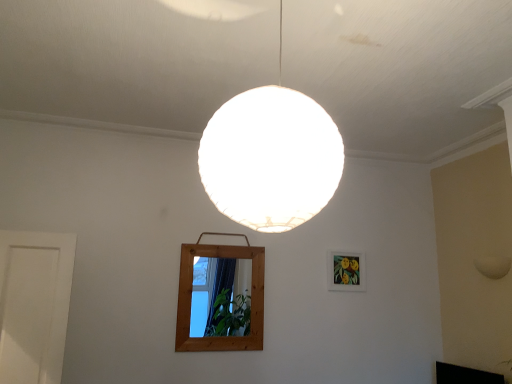
In order to face black glossy tv at lower right, should I rotate leftwards or rightwards?

A 26.263 degree turn to the right will do.

At what (x,y) coordinates should I click in order to perform the action: click on black glossy tv at lower right. Please return your answer as a coordinate pair (x, y). Image resolution: width=512 pixels, height=384 pixels. Looking at the image, I should click on pyautogui.click(x=465, y=375).

Is matte wooden picture frame at upper right closer to the viewer compared to black glossy tv at lower right?

No, matte wooden picture frame at upper right is further to the viewer.

Would you say matte wooden picture frame at upper right is outside black glossy tv at lower right?

That's correct, matte wooden picture frame at upper right is outside of black glossy tv at lower right.

How much distance is there between matte wooden picture frame at upper right and black glossy tv at lower right?

matte wooden picture frame at upper right and black glossy tv at lower right are 33.46 inches apart from each other.

From the image's perspective, would you say matte wooden picture frame at upper right is shown under black glossy tv at lower right?

Actually, matte wooden picture frame at upper right appears above black glossy tv at lower right in the image.

Is wooden mirror at center behind black glossy tv at lower right?

Yes, it is behind black glossy tv at lower right.

Find the location of `furniture in front of the wooden mirror at center`. furniture in front of the wooden mirror at center is located at coordinates (465, 375).

Could you tell me if wooden mirror at center is turned towards black glossy tv at lower right?

No.

How different are the orientations of wooden mirror at center and black glossy tv at lower right in degrees?

There is a 85.2-degree angle between the facing directions of wooden mirror at center and black glossy tv at lower right.

Can you confirm if white matte sphere at center is taller than matte wooden picture frame at upper right?

Yes, white matte sphere at center is taller than matte wooden picture frame at upper right.

From a real-world perspective, which object rests below the other?

From a 3D spatial view, matte wooden picture frame at upper right is below.

In the image, is white matte sphere at center positioned in front of or behind matte wooden picture frame at upper right?

white matte sphere at center is positioned closer to the viewer than matte wooden picture frame at upper right.

Looking at their sizes, would you say white matte sphere at center is wider or thinner than matte wooden picture frame at upper right?

white matte sphere at center is wider than matte wooden picture frame at upper right.

How much distance is there between matte wooden picture frame at upper right and white matte sphere at center?

matte wooden picture frame at upper right is 6.78 feet away from white matte sphere at center.

Could you tell me if matte wooden picture frame at upper right is facing white matte sphere at center?

No, matte wooden picture frame at upper right is not turned towards white matte sphere at center.

Is point (355, 280) closer to camera compared to point (260, 162)?

No, it is behind (260, 162).

Find the location of `lamp positioned vertically above the matte wooden picture frame at upper right (from a real-world perspective)`. lamp positioned vertically above the matte wooden picture frame at upper right (from a real-world perspective) is located at coordinates (271, 157).

Is wooden mirror at center shorter than white matte sphere at center?

Yes, wooden mirror at center is shorter than white matte sphere at center.

Looking at this image, from the image's perspective, would you say wooden mirror at center is shown under white matte sphere at center?

Yes, from the image's perspective, wooden mirror at center is below white matte sphere at center.

Is wooden mirror at center not within white matte sphere at center?

Yes, wooden mirror at center is not within white matte sphere at center.

Which object is thinner, wooden mirror at center or white matte sphere at center?

wooden mirror at center is thinner.

Which of these two, black glossy tv at lower right or matte wooden picture frame at upper right, is thinner?

Thinner between the two is matte wooden picture frame at upper right.

What are the coordinates of `furniture lying below the matte wooden picture frame at upper right (from the image's perspective)` in the screenshot? It's located at (465, 375).

From the image's perspective, which object appears higher, black glossy tv at lower right or matte wooden picture frame at upper right?

matte wooden picture frame at upper right is shown above in the image.

Would you consider matte wooden picture frame at upper right to be distant from wooden mirror at center?

matte wooden picture frame at upper right is actually quite close to wooden mirror at center.

Consider the image. Would you say matte wooden picture frame at upper right is inside or outside wooden mirror at center?

matte wooden picture frame at upper right is not inside wooden mirror at center, it's outside.

Considering the relative positions of matte wooden picture frame at upper right and wooden mirror at center in the image provided, is matte wooden picture frame at upper right to the left or to the right of wooden mirror at center?

Clearly, matte wooden picture frame at upper right is on the right of wooden mirror at center in the image.

In terms of height, does matte wooden picture frame at upper right look taller or shorter compared to wooden mirror at center?

matte wooden picture frame at upper right is shorter than wooden mirror at center.

Locate an element on the screen. furniture lying in front of the matte wooden picture frame at upper right is located at coordinates (465, 375).

This screenshot has width=512, height=384. I want to click on window behind the black glossy tv at lower right, so click(x=191, y=299).

When comparing their distances from black glossy tv at lower right, does matte wooden picture frame at upper right or white matte sphere at center seem closer?

Based on the image, matte wooden picture frame at upper right appears to be nearer to black glossy tv at lower right.

When comparing their distances from matte wooden picture frame at upper right, does wooden mirror at center or black glossy tv at lower right seem closer?

wooden mirror at center is closer to matte wooden picture frame at upper right.

Considering their positions, is black glossy tv at lower right positioned further to wooden mirror at center than white matte sphere at center?

white matte sphere at center is further to wooden mirror at center.

Which object lies further to the anchor point white matte sphere at center, matte wooden picture frame at upper right or black glossy tv at lower right?

black glossy tv at lower right is further to white matte sphere at center.

Considering their positions, is black glossy tv at lower right positioned further to white matte sphere at center than matte wooden picture frame at upper right?

black glossy tv at lower right.

Which object lies further to the anchor point matte wooden picture frame at upper right, black glossy tv at lower right or white matte sphere at center?

Based on the image, white matte sphere at center appears to be further to matte wooden picture frame at upper right.

Based on their spatial positions, is black glossy tv at lower right or wooden mirror at center further from white matte sphere at center?

The object further to white matte sphere at center is black glossy tv at lower right.

Looking at this image, which object lies further to the anchor point matte wooden picture frame at upper right, wooden mirror at center or white matte sphere at center?

Based on the image, white matte sphere at center appears to be further to matte wooden picture frame at upper right.

At what (x,y) coordinates should I click in order to perform the action: click on picture frame between wooden mirror at center and black glossy tv at lower right from left to right. Please return your answer as a coordinate pair (x, y). The image size is (512, 384). Looking at the image, I should click on (346, 271).

Locate an element on the screen. This screenshot has height=384, width=512. window between white matte sphere at center and matte wooden picture frame at upper right along the z-axis is located at coordinates (191, 299).

Where is `furniture positioned between white matte sphere at center and matte wooden picture frame at upper right from near to far`? This screenshot has width=512, height=384. furniture positioned between white matte sphere at center and matte wooden picture frame at upper right from near to far is located at coordinates (465, 375).

This screenshot has width=512, height=384. Identify the location of furniture positioned between white matte sphere at center and wooden mirror at center from near to far. (465, 375).